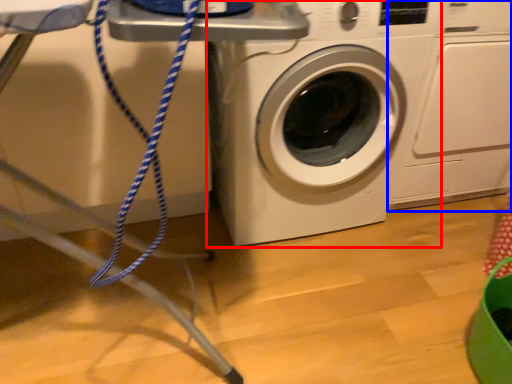
Question: Among these objects, which one is farthest to the camera, washing machine (highlighted by a red box) or washing machine (highlighted by a blue box)?

Choices:
 (A) washing machine
 (B) washing machine

Answer: (B)